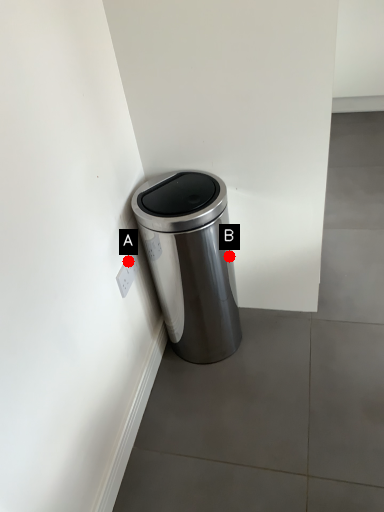
Question: Two points are circled on the image, labeled by A and B beside each circle. Which of the following is the closest to the observer?

Choices:
 (A) A is closer
 (B) B is closer

Answer: (A)